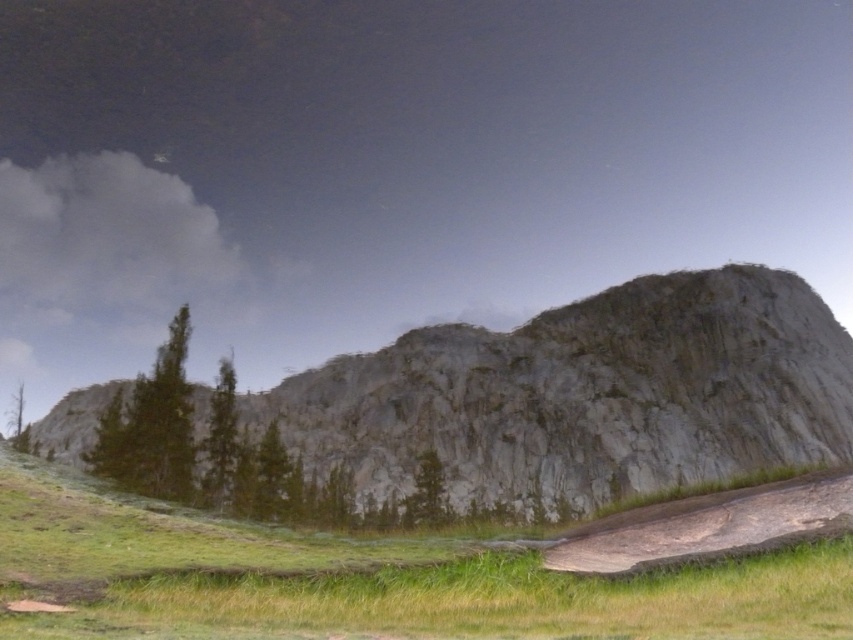
In order to click on rugged stone mountain at center in this screenshot , I will do `click(584, 397)`.

The height and width of the screenshot is (640, 853). Describe the element at coordinates (584, 397) in the screenshot. I see `rugged stone mountain at center` at that location.

Between point (405, 413) and point (795, 612), which one is positioned behind?

Positioned behind is point (405, 413).

This screenshot has height=640, width=853. I want to click on rugged stone mountain at center, so click(584, 397).